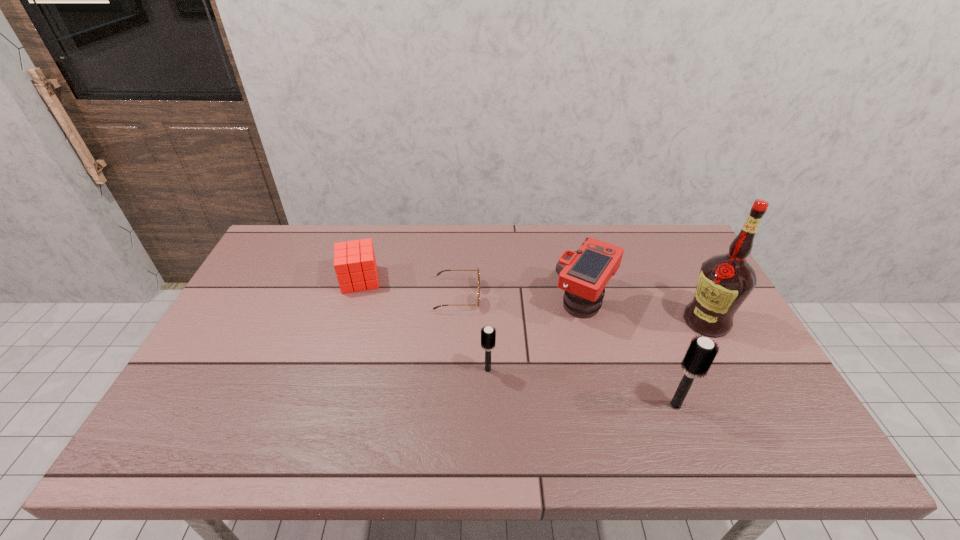
Find the location of a particular element. unoccupied area between the camera and the farther hairbrush is located at coordinates (536, 335).

Where is `unoccupied position between the camera and the fifth object from left to right`? The width and height of the screenshot is (960, 540). unoccupied position between the camera and the fifth object from left to right is located at coordinates (630, 353).

Find the location of a particular element. The height and width of the screenshot is (540, 960). free point between the sunglasses and the nearest object is located at coordinates (566, 350).

Locate which object ranks fifth in proximity to the left hairbrush. Please provide its 2D coordinates. Your answer should be formatted as a tuple, i.e. [(x, y)], where the tuple contains the x and y coordinates of a point satisfying the conditions above.

[(725, 281)]

The image size is (960, 540). Find the location of `the closest object to the second tallest object`. the closest object to the second tallest object is located at coordinates (725, 281).

Where is `blank area in the image that satisfies the following two spatial constraints: 1. on the back side of the fourth object from left to right; 2. on the lenses of the sunglasses`? This screenshot has width=960, height=540. blank area in the image that satisfies the following two spatial constraints: 1. on the back side of the fourth object from left to right; 2. on the lenses of the sunglasses is located at coordinates (583, 295).

At what (x,y) coordinates should I click in order to perform the action: click on vacant space that satisfies the following two spatial constraints: 1. on the label of the rightmost object; 2. on the front side of the taller hairbrush. Please return your answer as a coordinate pair (x, y). Looking at the image, I should click on (751, 405).

The image size is (960, 540). Find the location of `vacant space that satisfies the following two spatial constraints: 1. on the lenses of the shorter hairbrush; 2. on the left side of the shortest object`. vacant space that satisfies the following two spatial constraints: 1. on the lenses of the shorter hairbrush; 2. on the left side of the shortest object is located at coordinates (454, 369).

I want to click on free spot that satisfies the following two spatial constraints: 1. on the lenses of the camera; 2. on the left side of the shortest object, so click(x=458, y=301).